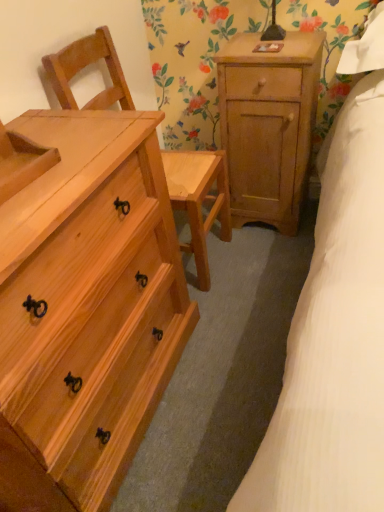
At what (x,y) coordinates should I click in order to perform the action: click on free point above natural wood nightstand at upper right (from a real-world perspective). Please return your answer as a coordinate pair (x, y). Image resolution: width=384 pixels, height=512 pixels. Looking at the image, I should click on (267, 51).